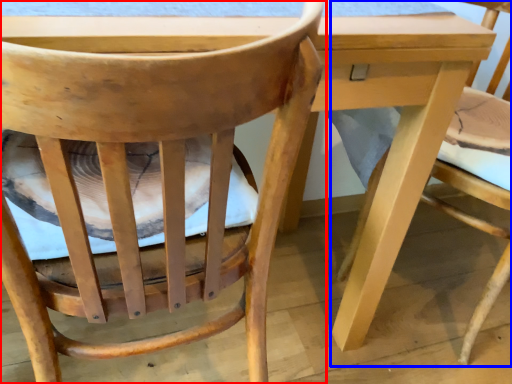
Question: Among these objects, which one is farthest to the camera, chair (highlighted by a red box) or chair (highlighted by a blue box)?

Choices:
 (A) chair
 (B) chair

Answer: (B)